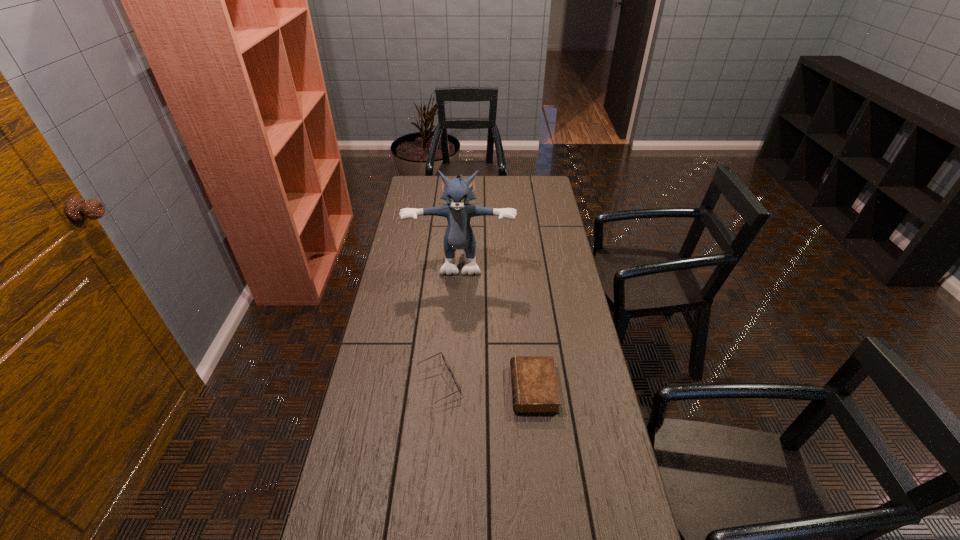
This screenshot has height=540, width=960. I want to click on the tallest object, so click(x=459, y=235).

Where is `cat`? Image resolution: width=960 pixels, height=540 pixels. cat is located at coordinates (459, 235).

Find the location of `spectacles`. spectacles is located at coordinates (459, 389).

Locate an element on the screen. diary is located at coordinates (535, 389).

Locate an element on the screen. This screenshot has height=540, width=960. free space located on the front-facing side of the tallest object is located at coordinates (460, 285).

Image resolution: width=960 pixels, height=540 pixels. I want to click on vacant space located with the lenses facing outward on the spectacles, so click(x=509, y=383).

Identify the location of vacant area situated on the spine side of the diary. The height and width of the screenshot is (540, 960). (429, 388).

At what (x,y) coordinates should I click in order to perform the action: click on vacant position located on the spine side of the diary. Please return your answer as a coordinate pair (x, y). The image size is (960, 540). Looking at the image, I should click on (476, 388).

The image size is (960, 540). Identify the location of free spot located 0.220m on the spine side of the diary. (442, 388).

Where is `object that is at the left edge`? The image size is (960, 540). object that is at the left edge is located at coordinates (459, 235).